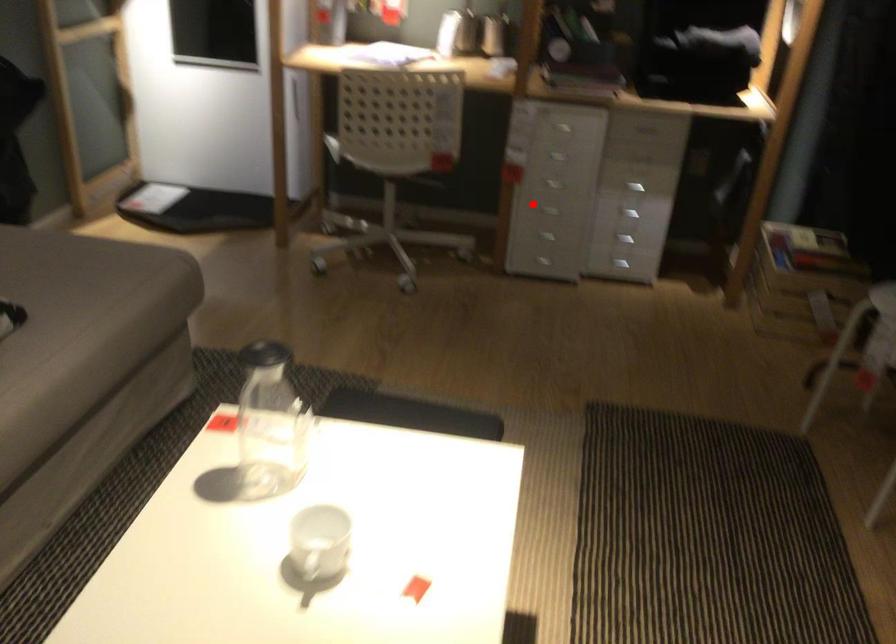
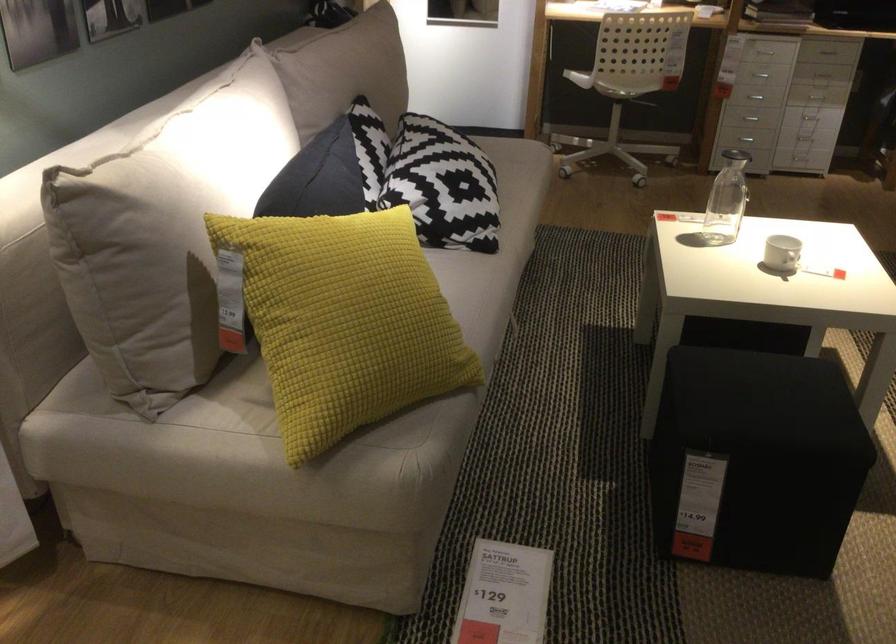
Locate, in the second image, the point that corresponds to the highlighted location in the first image.

(755, 97)